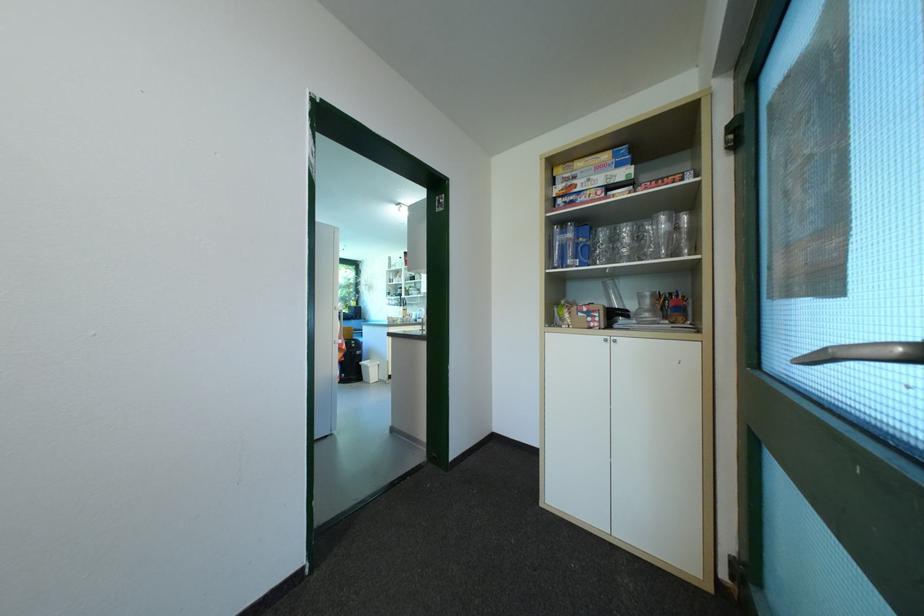
Which object does [589,195] point to?

This point indicates the red game box.